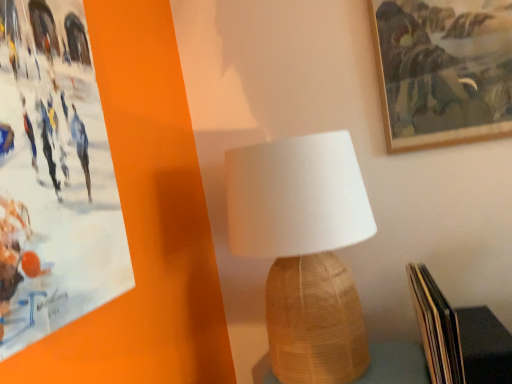
Question: Considering the relative sizes of woven wood table at center and wooden picture frame at upper right in the image provided, is woven wood table at center shorter than wooden picture frame at upper right?

Choices:
 (A) yes
 (B) no

Answer: (A)

Question: Can you see woven wood table at center touching wooden picture frame at upper right?

Choices:
 (A) no
 (B) yes

Answer: (A)

Question: Is the position of woven wood table at center less distant than that of wooden picture frame at upper right?

Choices:
 (A) no
 (B) yes

Answer: (B)

Question: Is woven wood table at center thinner than wooden picture frame at upper right?

Choices:
 (A) no
 (B) yes

Answer: (A)

Question: Is woven wood table at center turned away from wooden picture frame at upper right?

Choices:
 (A) yes
 (B) no

Answer: (B)

Question: From their relative heights in the image, would you say wooden picture frame at upper right is taller or shorter than white woven lampshade at center?

Choices:
 (A) short
 (B) tall

Answer: (A)

Question: Considering the relative positions of wooden picture frame at upper right and white woven lampshade at center in the image provided, is wooden picture frame at upper right to the left or to the right of white woven lampshade at center?

Choices:
 (A) left
 (B) right

Answer: (B)

Question: In terms of size, does wooden picture frame at upper right appear bigger or smaller than white woven lampshade at center?

Choices:
 (A) big
 (B) small

Answer: (B)

Question: Which is correct: wooden picture frame at upper right is inside white woven lampshade at center, or outside of it?

Choices:
 (A) inside
 (B) outside

Answer: (B)

Question: Considering the positions of point (423, 314) and point (422, 66), is point (423, 314) closer or farther from the camera than point (422, 66)?

Choices:
 (A) closer
 (B) farther

Answer: (A)

Question: From the image's perspective, relative to wooden picture frame at upper right, is hardcover book at lower right above or below?

Choices:
 (A) below
 (B) above

Answer: (A)

Question: Is hardcover book at lower right wider or thinner than wooden picture frame at upper right?

Choices:
 (A) wide
 (B) thin

Answer: (A)

Question: Is hardcover book at lower right inside the boundaries of wooden picture frame at upper right, or outside?

Choices:
 (A) outside
 (B) inside

Answer: (A)

Question: From a real-world perspective, is wooden picture frame at upper right physically located above or below woven wood table at center?

Choices:
 (A) above
 (B) below

Answer: (A)

Question: From the image's perspective, is wooden picture frame at upper right located above or below woven wood table at center?

Choices:
 (A) above
 (B) below

Answer: (A)